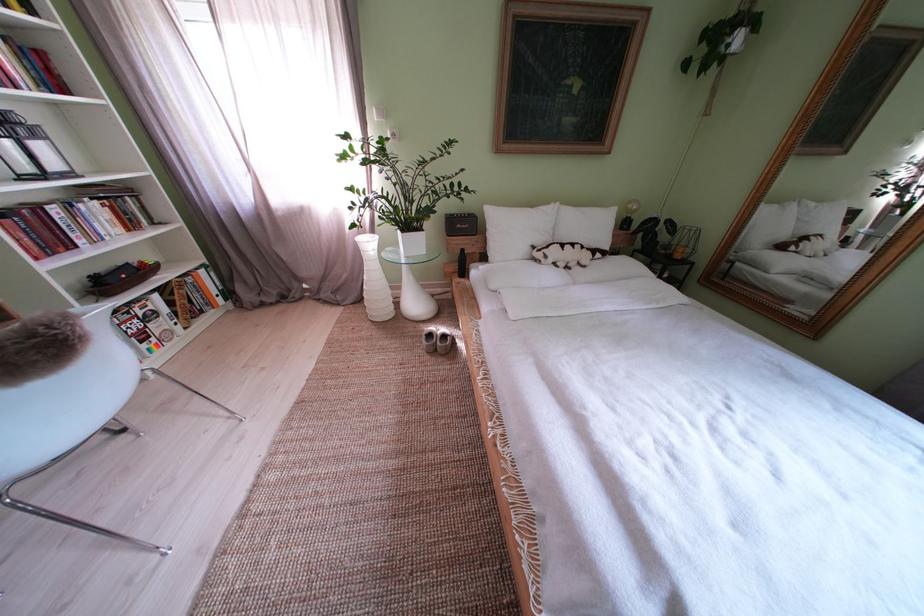
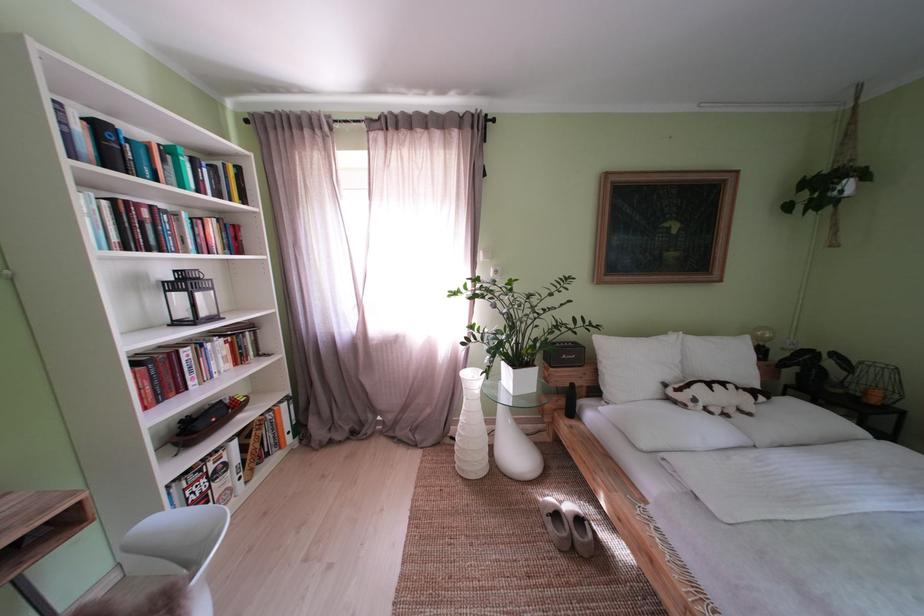
Question: What movement of the cameraman would produce the second image?

Choices:
 (A) Left
 (B) Right
 (C) Forward
 (D) Backward

Answer: (A)